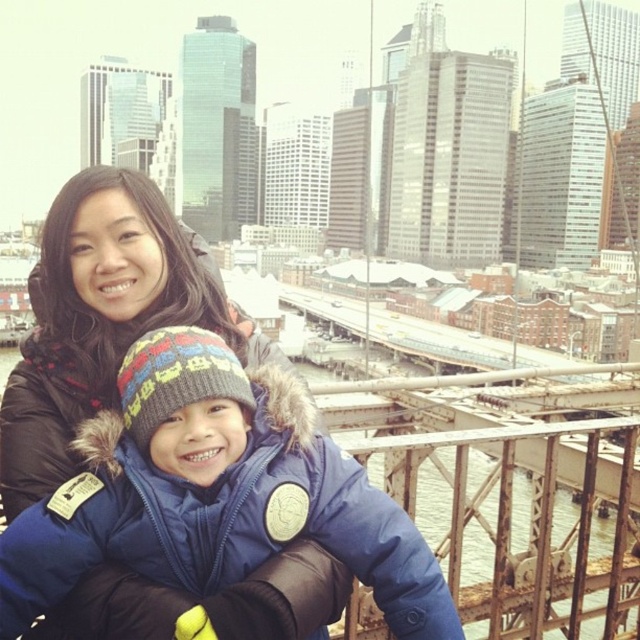
Does blue down jacket at center have a lesser height compared to matte black coat at center?

Yes.

Is point (365, 572) farther from camera compared to point (74, 342)?

No, (365, 572) is in front of (74, 342).

You are a GUI agent. You are given a task and a screenshot of the screen. Output one action in this format:
    pyautogui.click(x=<x>, y=<y>)
    Task: Click on the blue down jacket at center
    Image resolution: width=640 pixels, height=640 pixels.
    Given the screenshot: What is the action you would take?
    point(212,493)